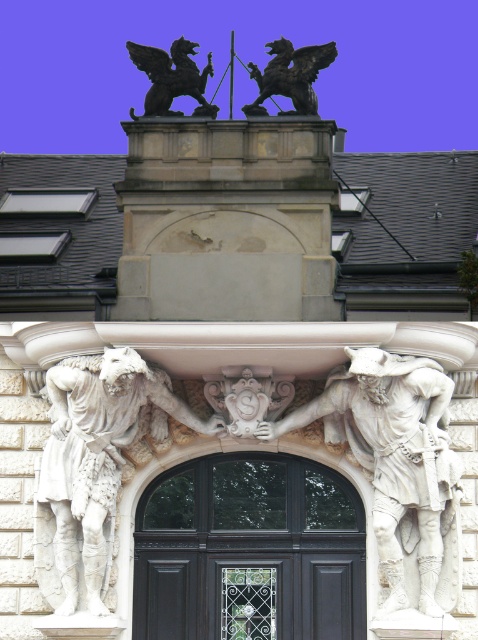
structural integrity is a concern for the building. Given that the white marble statue at center is wider than the black stone griffin at upper center, which object might pose a greater risk of falling due to its width?

structural integrity is a concern for the building. Given that the white marble statue at center is wider than the black stone griffin at upper center, the white marble statue at center might pose a greater risk of falling due to its width since it has a larger surface area exposed to wind or other forces compared to the narrower black stone griffin at upper center.

You are a delivery person trying to deliver a package to the black wood door at center. However, there is a white marble statue at center blocking your path. Can you walk around the statue to reach the door?

The black wood door at center has a smaller size compared to the white marble statue at center, so the statue is larger and might block the path more. You might need to find another route or move the statue to access the door.

You are an architect examining the building facade. You notice the white marble statue at center and the black stone griffin at upper center. Which object is positioned higher up on the facade?

The black stone griffin at upper center is positioned higher up on the facade than the white marble statue at center.